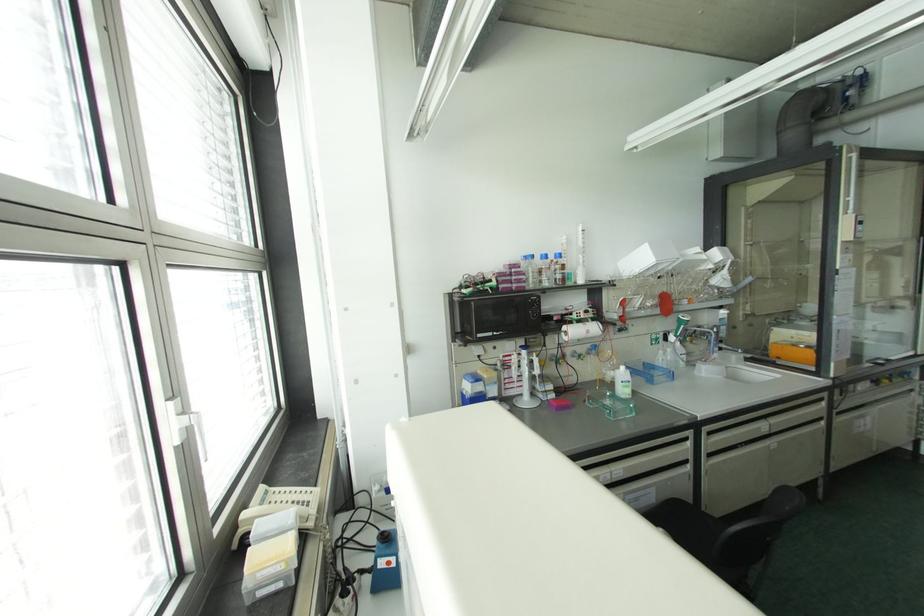
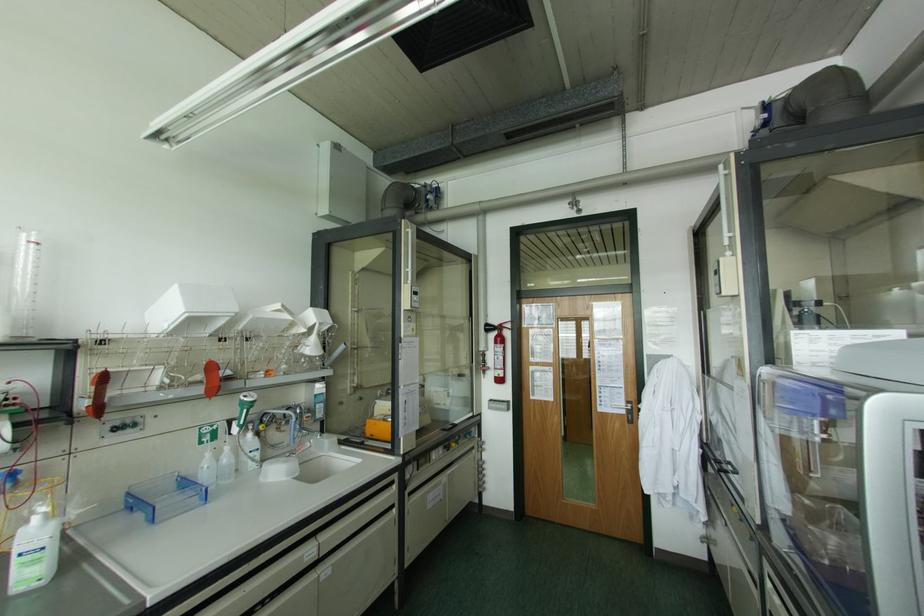
In the second image, find the point that corresponds to point 618,330 in the first image.

(115, 428)